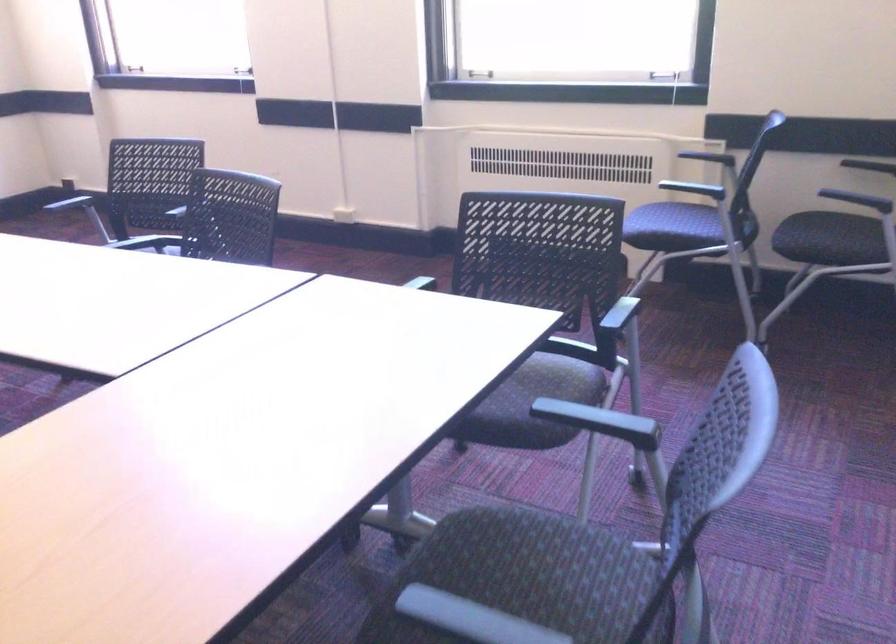
Where would you sit the dark chair surface? Please return your answer as a coordinate pair (x, y).

(533, 556)